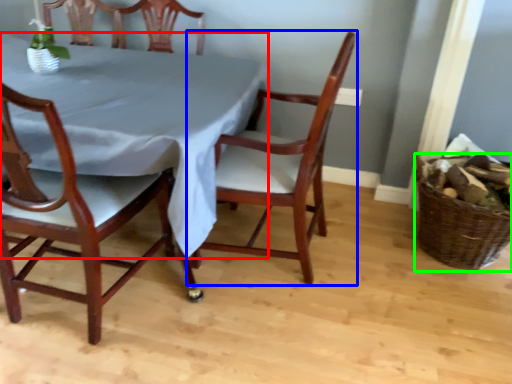
Question: Based on their relative distances, which object is farther from tablecloth (highlighted by a red box)? Choose from chair (highlighted by a blue box) and basket (highlighted by a green box).

Choices:
 (A) chair
 (B) basket

Answer: (B)